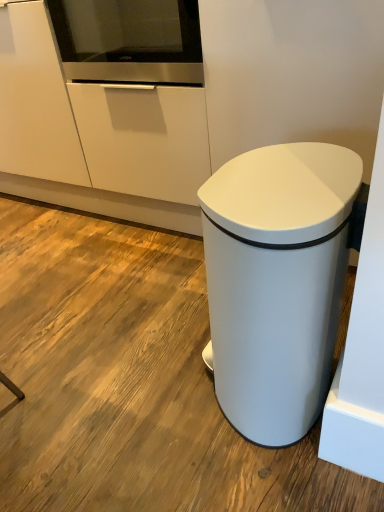
Identify the location of vacant space that is to the left of white matte waste container at lower right. The height and width of the screenshot is (512, 384). (144, 401).